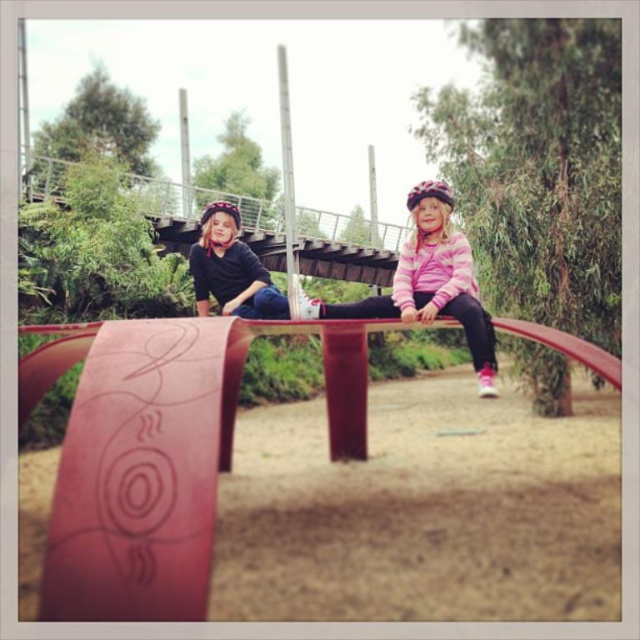
You are a photographer standing at the origin point of the image. You want to take a photo of the pink striped sweater at center. What are the coordinates of the sweater?

The coordinates of the pink striped sweater at center are at point (428, 282).

You are a parent supervising children at the playground. You notice the pink striped sweater at center and the matte black helmet at upper center. Which of these items is positioned higher in the image?

The pink striped sweater at center is above the matte black helmet at upper center, so it is positioned higher in the image.

You are a safety inspector checking the playground equipment. You notice the pink striped sweater at center and the matte black helmet at upper center. Which object takes up more space in the image?

The pink striped sweater at center has a larger size compared to the matte black helmet at upper center, so it takes up more space in the image.